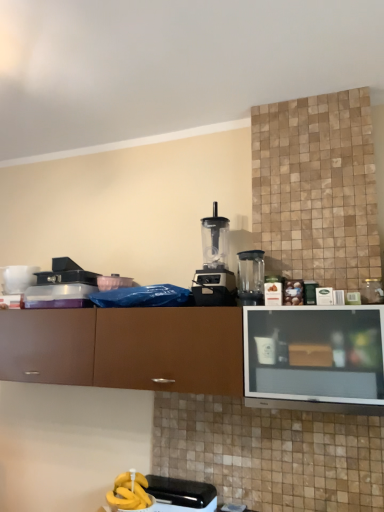
Question: Is black plastic toaster at lower center, positioned as the 1th appliance in bottom-to-top order, in contact with white glossy mug at upper left, acting as the 1th appliance starting from the back?

Choices:
 (A) no
 (B) yes

Answer: (A)

Question: Does black plastic toaster at lower center, positioned as the 1th appliance in bottom-to-top order, have a lesser height compared to white glossy mug at upper left, the 2th appliance when ordered from bottom to top?

Choices:
 (A) no
 (B) yes

Answer: (B)

Question: From the image's perspective, is black plastic toaster at lower center, which is counted as the 2th appliance, starting from the back, above white glossy mug at upper left, the 1th appliance positioned from the left?

Choices:
 (A) no
 (B) yes

Answer: (A)

Question: Is black plastic toaster at lower center, positioned as the 1th appliance in bottom-to-top order, thinner than white glossy mug at upper left, the 1th appliance positioned from the left?

Choices:
 (A) yes
 (B) no

Answer: (B)

Question: From a real-world perspective, is black plastic toaster at lower center, marked as the second appliance in a top-to-bottom arrangement, physically below white glossy mug at upper left, the 1th appliance positioned from the left?

Choices:
 (A) no
 (B) yes

Answer: (B)

Question: From their relative heights in the image, would you say black plastic toaster at lower center, the 1th appliance positioned from the right, is taller or shorter than transparent plastic blender at center, which is counted as the second kitchen appliance, starting from the left?

Choices:
 (A) short
 (B) tall

Answer: (A)

Question: Does point (173, 480) appear closer or farther from the camera than point (246, 302)?

Choices:
 (A) farther
 (B) closer

Answer: (A)

Question: Is black plastic toaster at lower center, the 1th appliance in the front-to-back sequence, wider or thinner than transparent plastic blender at center, which is counted as the second kitchen appliance, starting from the left?

Choices:
 (A) thin
 (B) wide

Answer: (B)

Question: Considering their positions, is black plastic toaster at lower center, positioned as the 1th appliance in bottom-to-top order, located in front of or behind transparent plastic blender at center, which is counted as the second kitchen appliance, starting from the left?

Choices:
 (A) behind
 (B) front

Answer: (B)

Question: From a real-world perspective, is black plastic blender at center, which ranks as the 2th kitchen appliance in right-to-left order, physically located above or below black plastic toaster at lower center, which is counted as the 2th appliance, starting from the back?

Choices:
 (A) below
 (B) above

Answer: (B)

Question: In terms of height, does black plastic blender at center, the 1th kitchen appliance in the left-to-right sequence, look taller or shorter compared to black plastic toaster at lower center, positioned as the 1th appliance in bottom-to-top order?

Choices:
 (A) short
 (B) tall

Answer: (B)

Question: Considering their positions, is black plastic blender at center, the 1th kitchen appliance in the left-to-right sequence, located in front of or behind black plastic toaster at lower center, which is counted as the 2th appliance, starting from the back?

Choices:
 (A) front
 (B) behind

Answer: (B)

Question: Considering the positions of black plastic blender at center, which ranks as the 2th kitchen appliance in right-to-left order, and black plastic toaster at lower center, marked as the second appliance in a top-to-bottom arrangement, in the image, is black plastic blender at center, which ranks as the 2th kitchen appliance in right-to-left order, bigger or smaller than black plastic toaster at lower center, marked as the second appliance in a top-to-bottom arrangement,?

Choices:
 (A) big
 (B) small

Answer: (A)

Question: Is point (170, 501) closer or farther from the camera than point (213, 292)?

Choices:
 (A) closer
 (B) farther

Answer: (A)

Question: Visually, is black plastic toaster at lower center, the 1th appliance positioned from the right, positioned to the left or to the right of black plastic blender at center, the 1th kitchen appliance in the left-to-right sequence?

Choices:
 (A) left
 (B) right

Answer: (A)